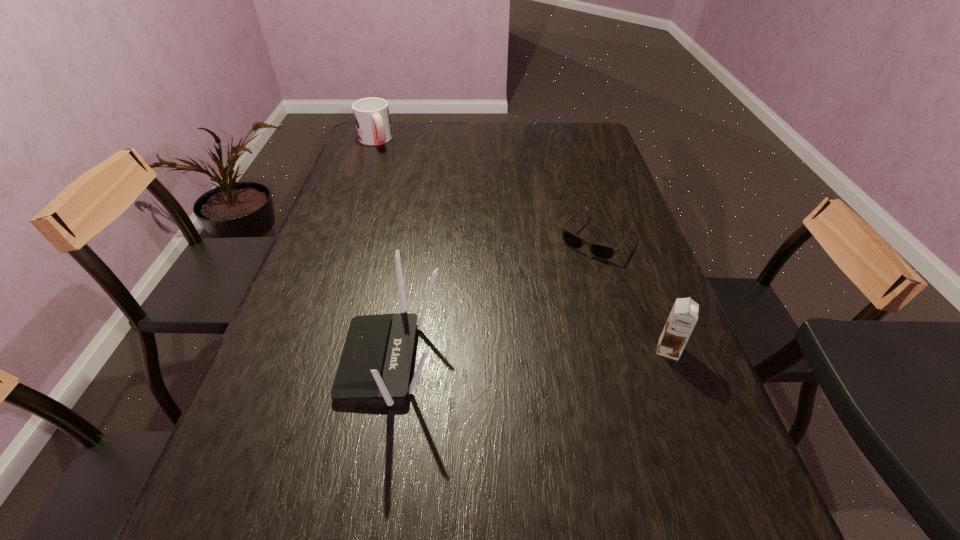
The height and width of the screenshot is (540, 960). In order to click on free space between the chocolate milk and the tallest object in this screenshot , I will do `click(530, 355)`.

Identify the location of free space between the mug and the second farthest object. This screenshot has width=960, height=540. (485, 189).

Where is `vacant area that lies between the leftmost object and the third nearest object`? Image resolution: width=960 pixels, height=540 pixels. vacant area that lies between the leftmost object and the third nearest object is located at coordinates (485, 189).

This screenshot has height=540, width=960. Find the location of `vacant space that is in between the sunglasses and the chocolate milk`. vacant space that is in between the sunglasses and the chocolate milk is located at coordinates (633, 293).

Locate an element on the screen. free space between the router and the second farthest object is located at coordinates (494, 299).

Identify the location of free space that is in between the shortest object and the chocolate milk. (633, 293).

Where is `free space between the router and the chocolate milk`? The image size is (960, 540). free space between the router and the chocolate milk is located at coordinates (530, 355).

This screenshot has width=960, height=540. Find the location of `object identified as the closest to the tallest object`. object identified as the closest to the tallest object is located at coordinates (600, 251).

Image resolution: width=960 pixels, height=540 pixels. Identify the location of object that is the closest to the chocolate milk. (600, 251).

You are a GUI agent. You are given a task and a screenshot of the screen. Output one action in this format:
    pyautogui.click(x=<x>, y=<y>)
    Task: Click on the free spot that satisfies the following two spatial constraints: 1. on the front side of the farthest object; 2. on the front-facing side of the tallest object
    
    Given the screenshot: What is the action you would take?
    pyautogui.click(x=295, y=360)